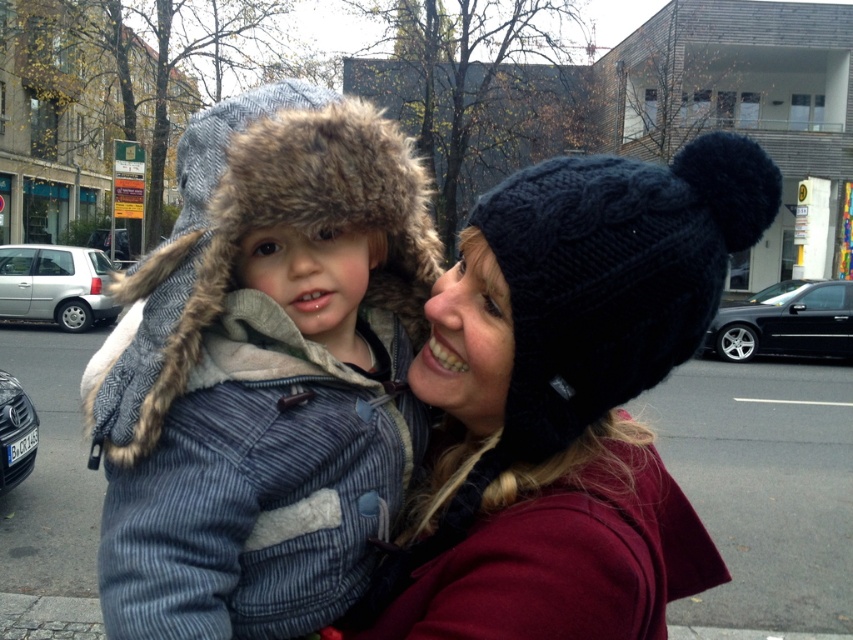
Question: Which point appears closest to the camera in this image?

Choices:
 (A) (425, 412)
 (B) (732, 220)

Answer: (B)

Question: Is fuzzy fur hat at center positioned in front of knitted dark blue beanie at center?

Choices:
 (A) no
 (B) yes

Answer: (A)

Question: From the image, what is the correct spatial relationship of fuzzy fur hat at center in relation to knitted dark blue beanie at center?

Choices:
 (A) below
 (B) above

Answer: (B)

Question: Which of the following is the closest to the observer?

Choices:
 (A) knitted dark blue beanie at center
 (B) fuzzy fur hat at center

Answer: (A)

Question: Does fuzzy fur hat at center have a lesser width compared to knitted dark blue beanie at center?

Choices:
 (A) no
 (B) yes

Answer: (A)

Question: Which point is farther to the camera?

Choices:
 (A) knitted dark blue beanie at center
 (B) fuzzy fur hat at center

Answer: (B)